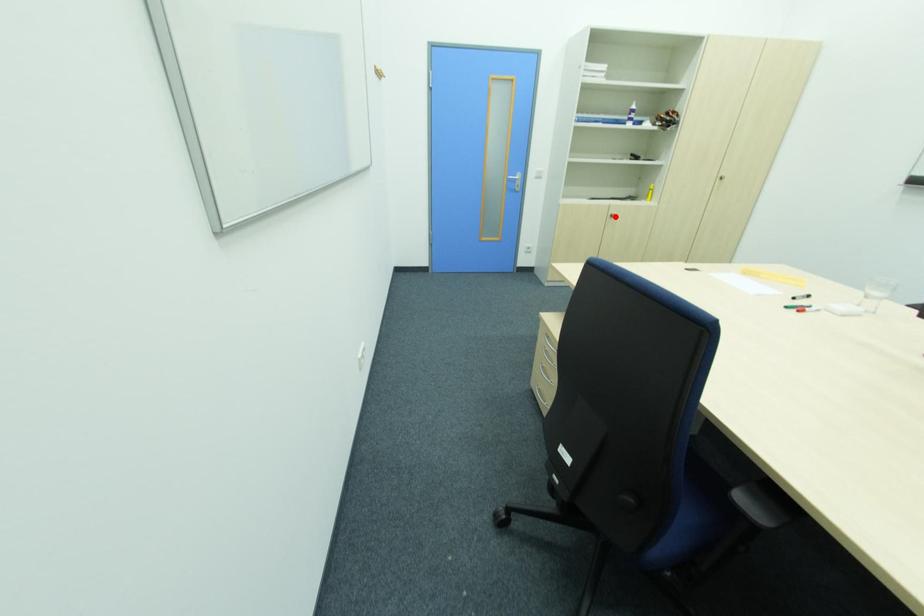
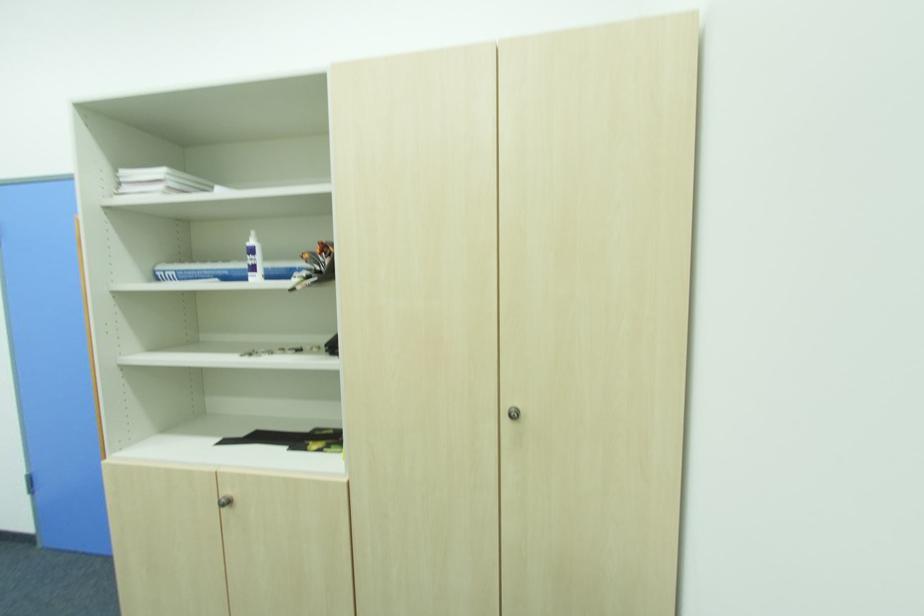
Where in the second image is the point corresponding to the highlighted location from the first image?

(229, 504)